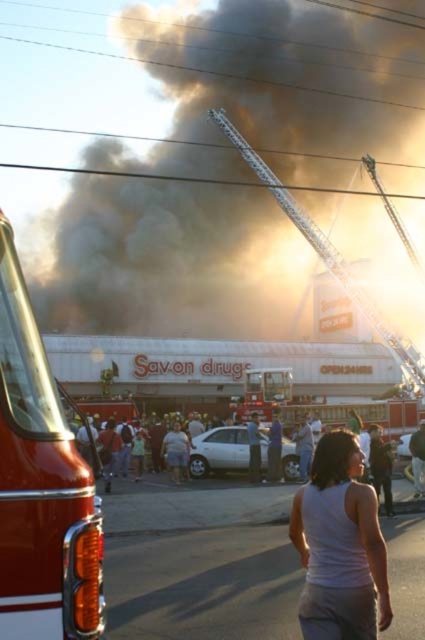
You are a firefighter at the scene of the fire at Sav on drugs. You see a white tank top at center and a white cotton shirt at center. You need to retrieve both items for evidence. If your reach is 1 meter, can you collect both items without moving?

The distance between the white tank top at center and the white cotton shirt at center is 17.37 meters. Since your reach is only 1 meter, you cannot collect both items without moving closer to them.